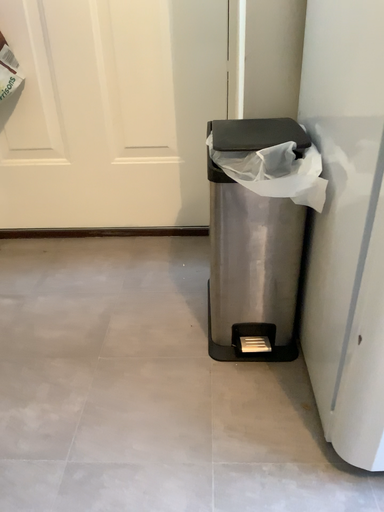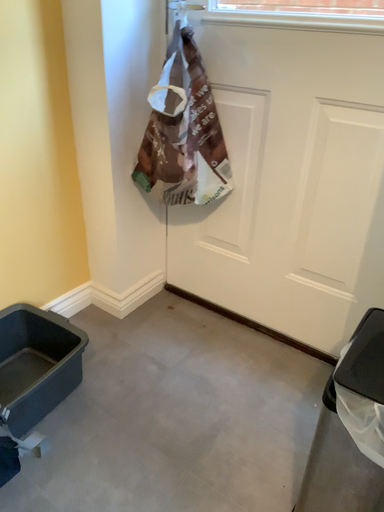
Question: How did the camera likely rotate when shooting the video?

Choices:
 (A) rotated right
 (B) rotated left

Answer: (B)